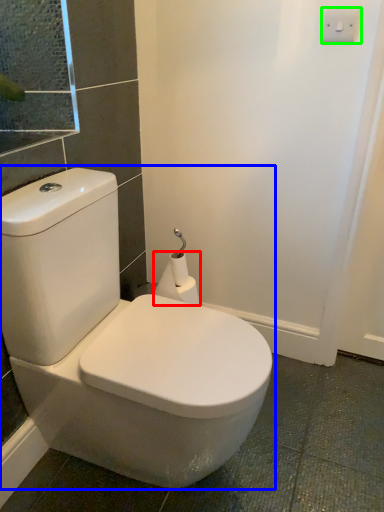
Question: Considering the real-world distances, which object is closest to toilet paper (highlighted by a red box)? toilet (highlighted by a blue box) or light switch (highlighted by a green box).

Choices:
 (A) toilet
 (B) light switch

Answer: (A)